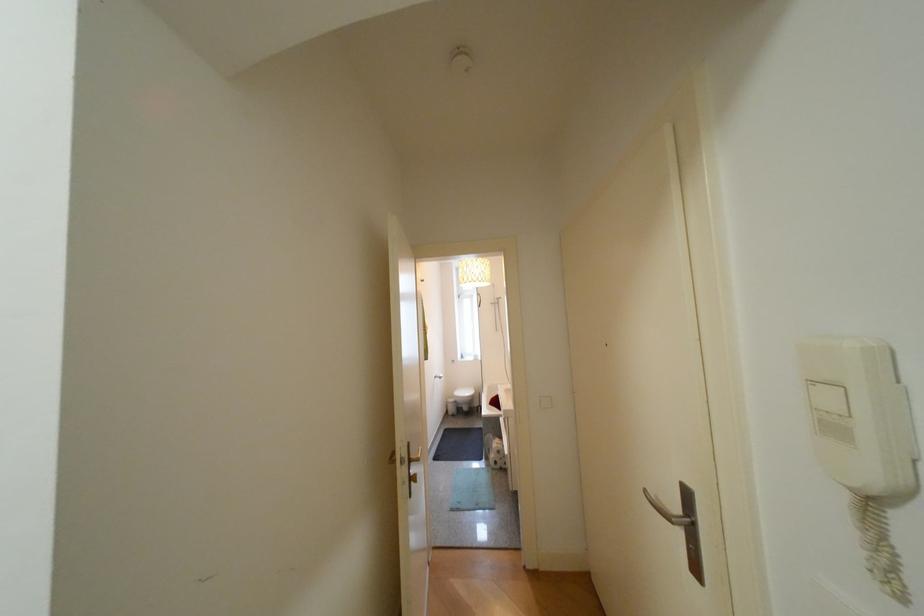
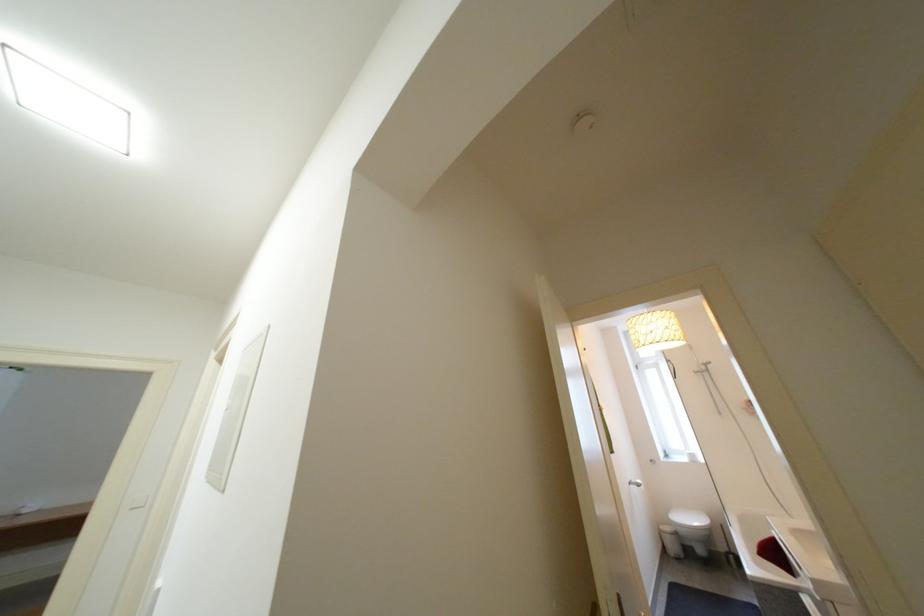
Locate, in the second image, the point that corresponds to point (445, 378) in the first image.

(639, 485)